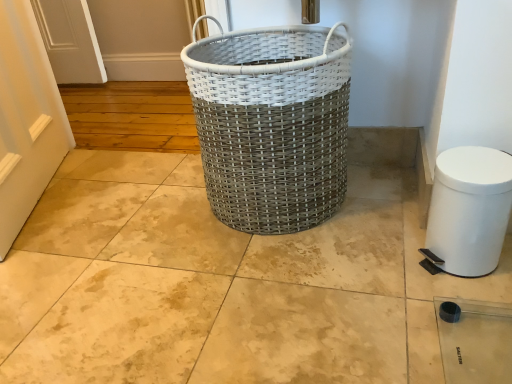
Where is `white woven basket at center`? Image resolution: width=512 pixels, height=384 pixels. white woven basket at center is located at coordinates (272, 124).

Describe the element at coordinates (272, 124) in the screenshot. This screenshot has height=384, width=512. I see `white woven basket at center` at that location.

Image resolution: width=512 pixels, height=384 pixels. What do you see at coordinates (469, 209) in the screenshot? I see `white plastic trash can at lower right` at bounding box center [469, 209].

This screenshot has height=384, width=512. I want to click on white plastic trash can at lower right, so click(469, 209).

Where is `white woven basket at center`? Image resolution: width=512 pixels, height=384 pixels. white woven basket at center is located at coordinates (272, 124).

Is white plastic trash can at lower right at the right side of white woven basket at center?

Yes.

Is white plastic trash can at lower right positioned before white woven basket at center?

Yes, it is.

Between point (488, 169) and point (318, 188), which one is positioned behind?

Point (318, 188)

From the image's perspective, between white plastic trash can at lower right and white woven basket at center, who is located below?

white plastic trash can at lower right is shown below in the image.

From a real-world perspective, does white plastic trash can at lower right sit lower than white woven basket at center?

Correct, in the physical world, white plastic trash can at lower right is lower than white woven basket at center.

Considering the relative sizes of white plastic trash can at lower right and white woven basket at center in the image provided, is white plastic trash can at lower right wider than white woven basket at center?

In fact, white plastic trash can at lower right might be narrower than white woven basket at center.

Considering the relative sizes of white plastic trash can at lower right and white woven basket at center in the image provided, is white plastic trash can at lower right taller than white woven basket at center?

In fact, white plastic trash can at lower right may be shorter than white woven basket at center.

In terms of size, does white plastic trash can at lower right appear bigger or smaller than white woven basket at center?

Clearly, white plastic trash can at lower right is smaller in size than white woven basket at center.

Is white plastic trash can at lower right completely or partially outside of white woven basket at center?

Yes.

Is white plastic trash can at lower right not near white woven basket at center?

Actually, white plastic trash can at lower right and white woven basket at center are a little close together.

Could you tell me if white plastic trash can at lower right is facing white woven basket at center?

No.

Can you tell me how much white plastic trash can at lower right and white woven basket at center differ in facing direction?

The angle between the facing direction of white plastic trash can at lower right and the facing direction of white woven basket at center is 0.152 degrees.

This screenshot has height=384, width=512. What are the coordinates of `waste container on the left of white plastic trash can at lower right` in the screenshot? It's located at tap(272, 124).

Is white woven basket at center to the left or to the right of white plastic trash can at lower right in the image?

In the image, white woven basket at center appears on the left side of white plastic trash can at lower right.

Is white woven basket at center positioned in front of white plastic trash can at lower right?

No, it is behind white plastic trash can at lower right.

Which is closer to the camera, (276, 228) or (493, 260)?

Point (276, 228).

From the image's perspective, is white woven basket at center beneath white plastic trash can at lower right?

No.

From a real-world perspective, is white woven basket at center physically above white plastic trash can at lower right?

Yes, from a real-world perspective, white woven basket at center is above white plastic trash can at lower right.

Does white woven basket at center have a greater width compared to white plastic trash can at lower right?

Yes, white woven basket at center is wider than white plastic trash can at lower right.

Considering the sizes of objects white woven basket at center and white plastic trash can at lower right in the image provided, who is shorter, white woven basket at center or white plastic trash can at lower right?

Standing shorter between the two is white plastic trash can at lower right.

Which of these two, white woven basket at center or white plastic trash can at lower right, is smaller?

white plastic trash can at lower right is smaller.

Would you say white woven basket at center is inside or outside white plastic trash can at lower right?

white woven basket at center is not enclosed by white plastic trash can at lower right.

Are white woven basket at center and white plastic trash can at lower right far apart?

No, white woven basket at center is not far from white plastic trash can at lower right.

Could you tell me if white woven basket at center is facing white plastic trash can at lower right?

No, white woven basket at center is not turned towards white plastic trash can at lower right.

How different are the orientations of white woven basket at center and white plastic trash can at lower right in degrees?

0.152 degrees separate the facing orientations of white woven basket at center and white plastic trash can at lower right.

How much distance is there between white woven basket at center and white plastic trash can at lower right?

They are 17.23 inches apart.

Find the location of `waste container above the white plastic trash can at lower right (from a real-world perspective)`. waste container above the white plastic trash can at lower right (from a real-world perspective) is located at coordinates (272, 124).

The image size is (512, 384). In order to click on waste container above the white plastic trash can at lower right (from the image's perspective) in this screenshot , I will do tap(272, 124).

Find the location of a particular element. Image resolution: width=512 pixels, height=384 pixels. gray that is below the white woven basket at center (from the image's perspective) is located at coordinates (469, 209).